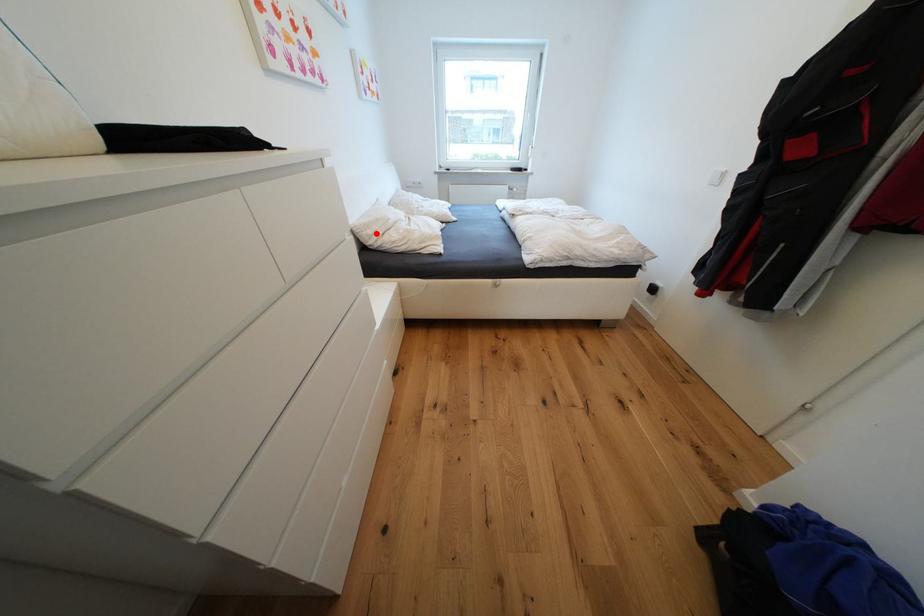
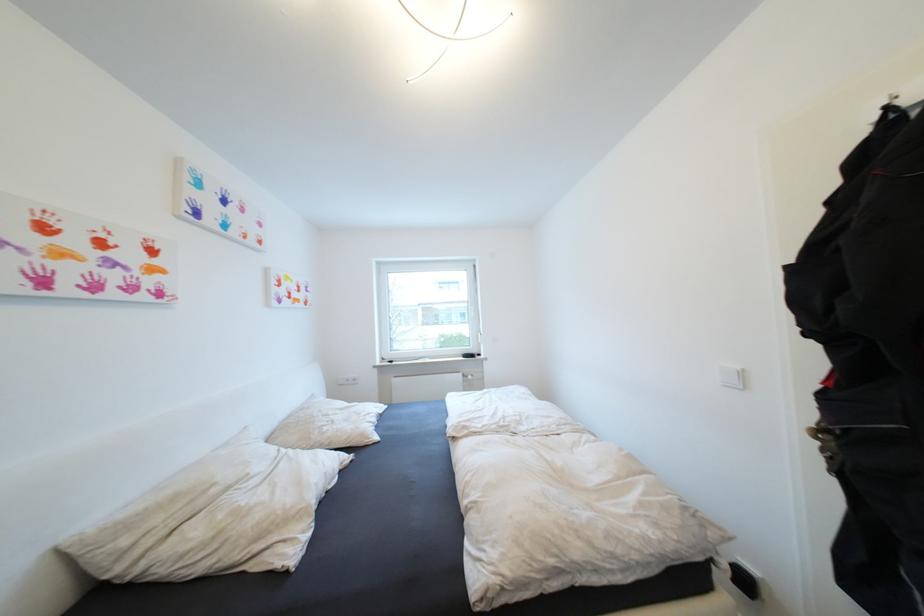
Locate, in the second image, the point that corresponds to the highlighted location in the first image.

(131, 543)